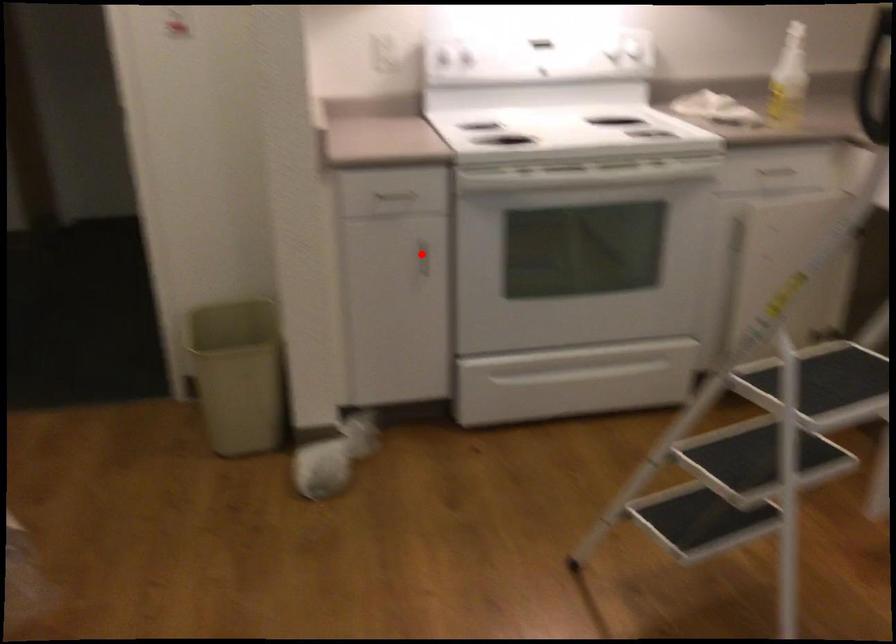
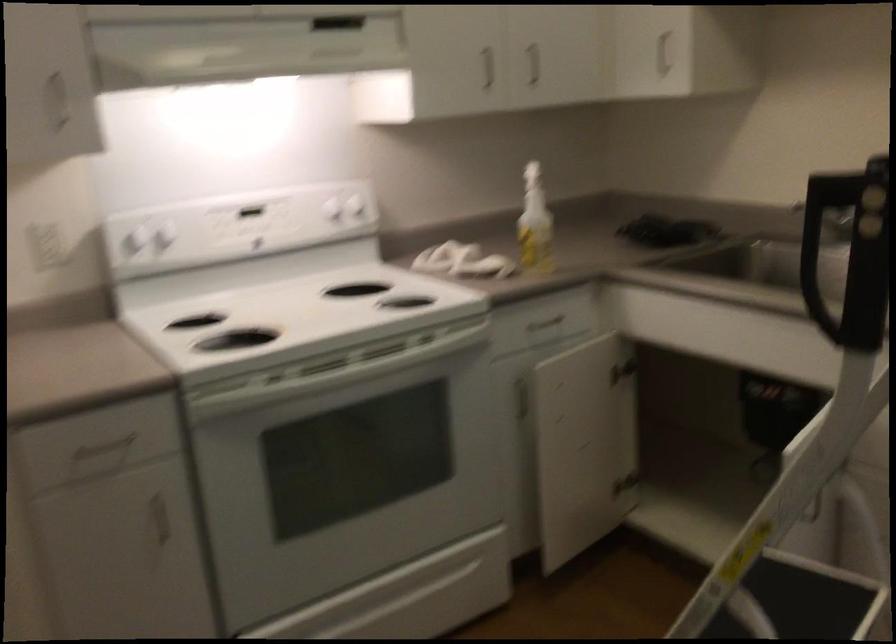
Where in the second image is the point corresponding to the highlighted location from the first image?

(159, 514)